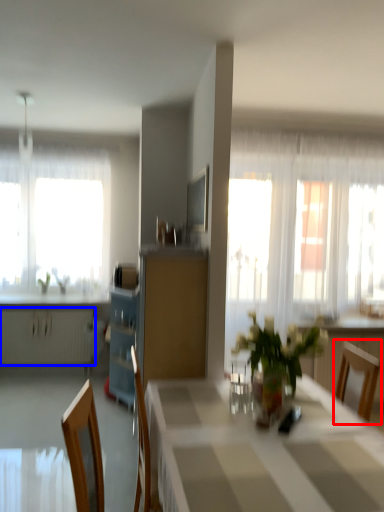
Question: Which object is further to the camera taking this photo, chair (highlighted by a red box) or radiator (highlighted by a blue box)?

Choices:
 (A) chair
 (B) radiator

Answer: (B)